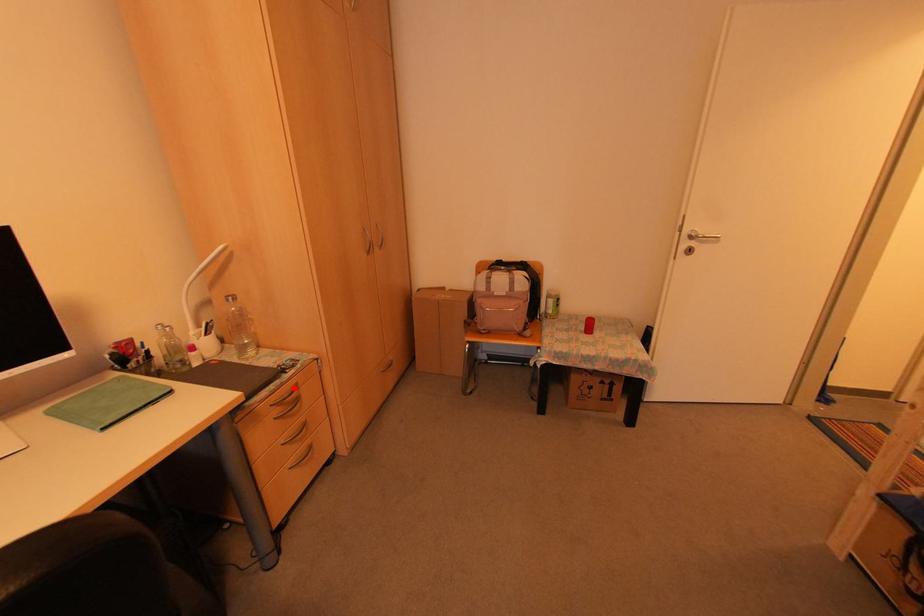
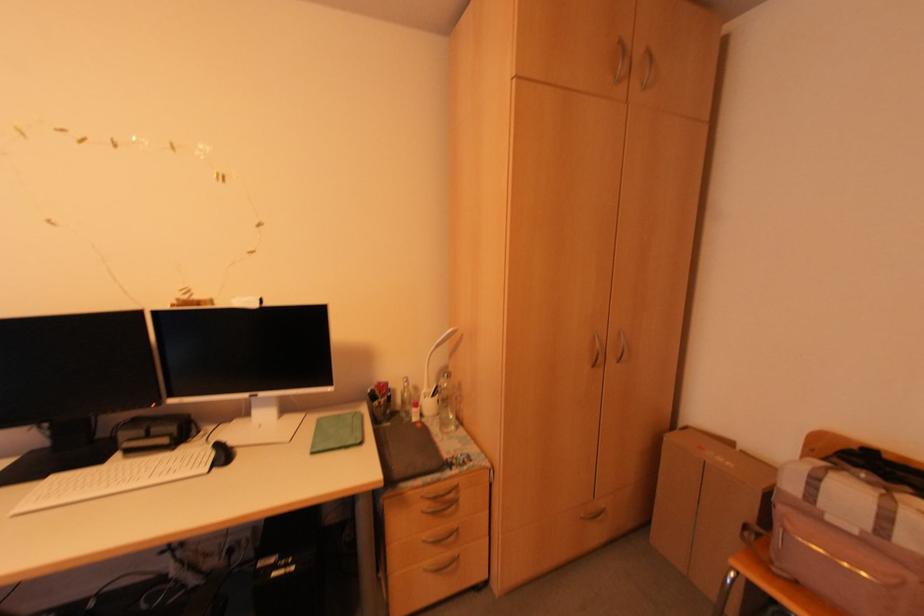
Find the pixel in the second image that matches the highlighted location in the first image.

(455, 488)